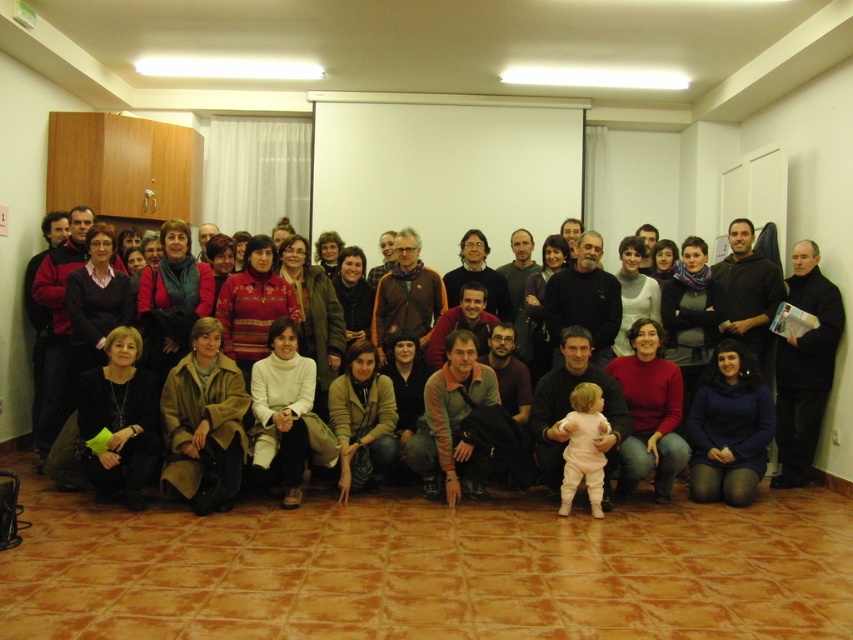
You are organizing a clothing donation drive and need to stack these jackets. The black matte jacket at right and the matte black jacket at lower center are both on a rack. Which jacket should you place on top to match their current arrangement?

You should place the black matte jacket at right on top of the matte black jacket at lower center because it is positioned over it in the image.

You are organizing a photo shoot and need to position two models wearing the black matte jacket at right and the matte black jacket at lower center. According to the scene, which jacket is positioned to the left of the other?

The black matte jacket at right is positioned to the left of the matte black jacket at lower center.